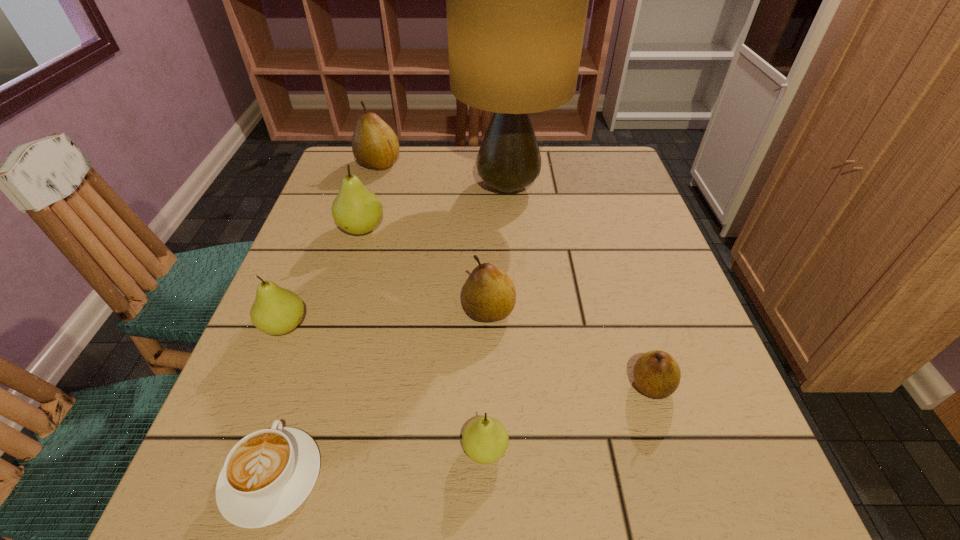
At what (x,y) coordinates should I click in order to perform the action: click on vacant area situated on the back of the smallest green pear. Please return your answer as a coordinate pair (x, y). This screenshot has width=960, height=540. Looking at the image, I should click on (484, 335).

Locate an element on the screen. vacant space located 0.310m on the back of the rightmost brown pear is located at coordinates (x=609, y=247).

At what (x,y) coordinates should I click in order to perform the action: click on vacant region located 0.330m on the side of the white cappuccino with the handle. Please return your answer as a coordinate pair (x, y). Looking at the image, I should click on (337, 278).

Where is `vacant space located on the side of the white cappuccino with the handle`? vacant space located on the side of the white cappuccino with the handle is located at coordinates (316, 341).

Where is `vacant space located on the side of the white cappuccino with the handle`? The height and width of the screenshot is (540, 960). vacant space located on the side of the white cappuccino with the handle is located at coordinates (319, 333).

Identify the location of lampshade present at the far edge. This screenshot has height=540, width=960. (517, 0).

Locate an element on the screen. This screenshot has width=960, height=540. pear present at the far edge is located at coordinates (375, 145).

The width and height of the screenshot is (960, 540). I want to click on pear that is at the near edge, so click(x=485, y=440).

Identify the location of cappuccino present at the near edge. This screenshot has width=960, height=540. (268, 474).

Locate an element on the screen. Image resolution: width=960 pixels, height=540 pixels. cappuccino at the left edge is located at coordinates (268, 474).